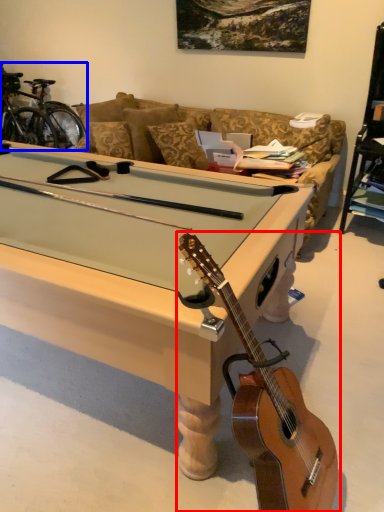
Question: Which object appears farthest to the camera in this image, guitar (highlighted by a red box) or bicycle (highlighted by a blue box)?

Choices:
 (A) guitar
 (B) bicycle

Answer: (B)